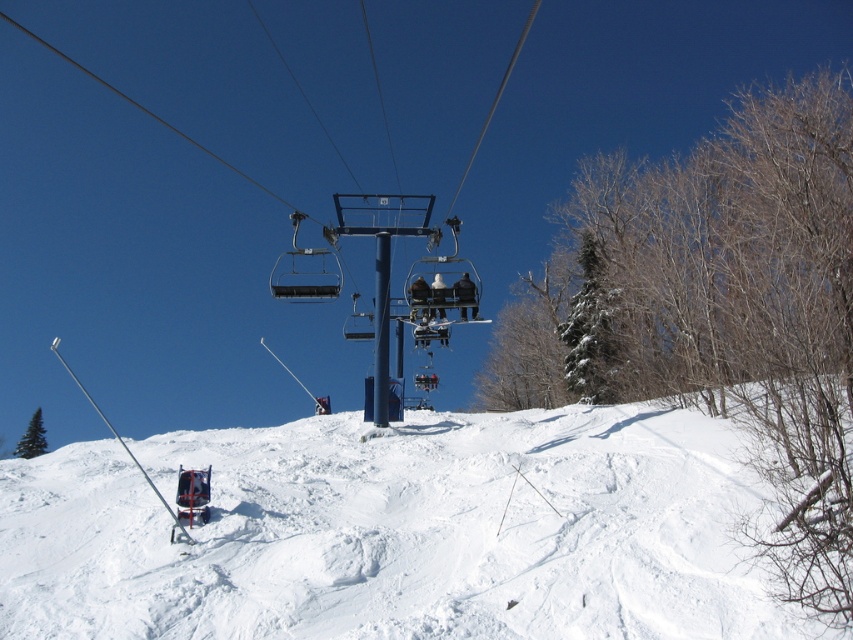
Question: Considering the relative positions of dark blue fabric jacket at center and white fabric jacket at center in the image provided, where is dark blue fabric jacket at center located with respect to white fabric jacket at center?

Choices:
 (A) left
 (B) right

Answer: (A)

Question: Where is blue metallic pole at center located in relation to white fabric jacket at center in the image?

Choices:
 (A) above
 (B) below

Answer: (B)

Question: Estimate the real-world distances between objects in this image. Which object is farther from the blue metallic pole at center?

Choices:
 (A) white powdery snow at center
 (B) dark blue fabric jacket at center

Answer: (A)

Question: Estimate the real-world distances between objects in this image. Which object is farther from the dark blue fabric jacket at center?

Choices:
 (A) blue metallic pole at center
 (B) white fabric jacket at center
 (C) white powdery snow at center

Answer: (C)

Question: Is white powdery snow at center thinner than dark blue fabric jacket at center?

Choices:
 (A) no
 (B) yes

Answer: (A)

Question: Based on their relative distances, which object is farther from the white powdery snow at center?

Choices:
 (A) dark blue fabric chair at center
 (B) dark blue fabric jacket at center
 (C) blue metallic pole at center
 (D) white fabric jacket at center

Answer: (A)